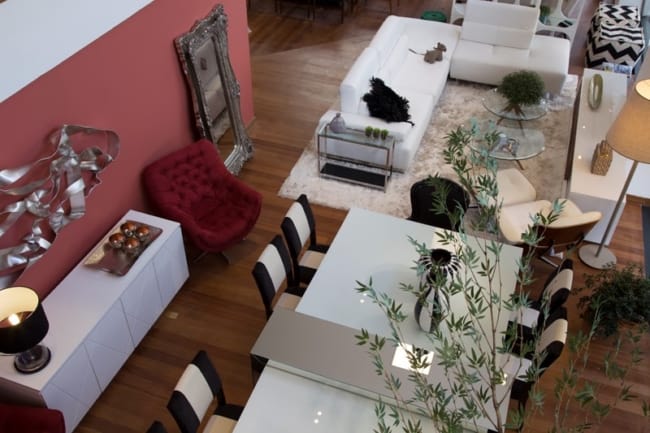
I want to click on yellowish lamp, so click(x=636, y=122).